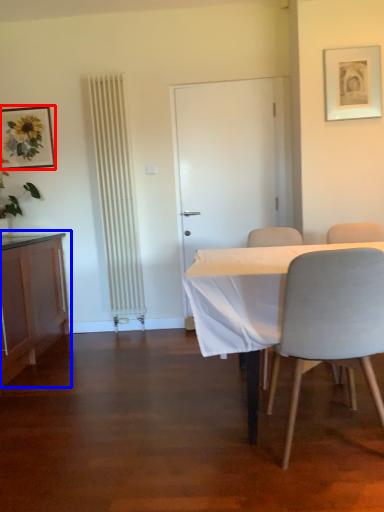
Question: Among these objects, which one is nearest to the camera, picture frame (highlighted by a red box) or cabinetry (highlighted by a blue box)?

Choices:
 (A) picture frame
 (B) cabinetry

Answer: (B)